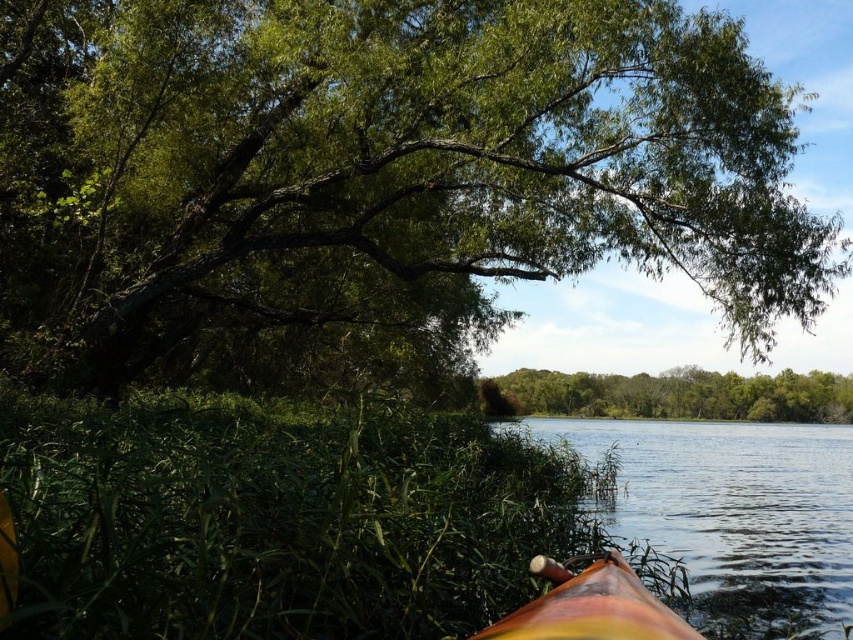
Question: Considering the real-world distances, which object is closest to the smooth brown water at lower right?

Choices:
 (A) rainbow-colored wood boat at lower center
 (B) green leafy trees at center

Answer: (B)

Question: In this image, where is smooth brown water at lower right located relative to rainbow-colored wood boat at lower center?

Choices:
 (A) right
 (B) left

Answer: (A)

Question: Observing the image, what is the correct spatial positioning of green leafy trees at center in reference to rainbow-colored wood boat at lower center?

Choices:
 (A) above
 (B) below

Answer: (B)

Question: Which of these objects is positioned farthest from the smooth brown water at lower right?

Choices:
 (A) rainbow-colored wood boat at lower center
 (B) green leafy tree at upper left

Answer: (A)

Question: Which of the following is the farthest from the observer?

Choices:
 (A) green leafy tree at upper left
 (B) rainbow-colored wood boat at lower center
 (C) smooth brown water at lower right

Answer: (A)

Question: Observing the image, what is the correct spatial positioning of smooth brown water at lower right in reference to rainbow-colored wood boat at lower center?

Choices:
 (A) below
 (B) above

Answer: (A)